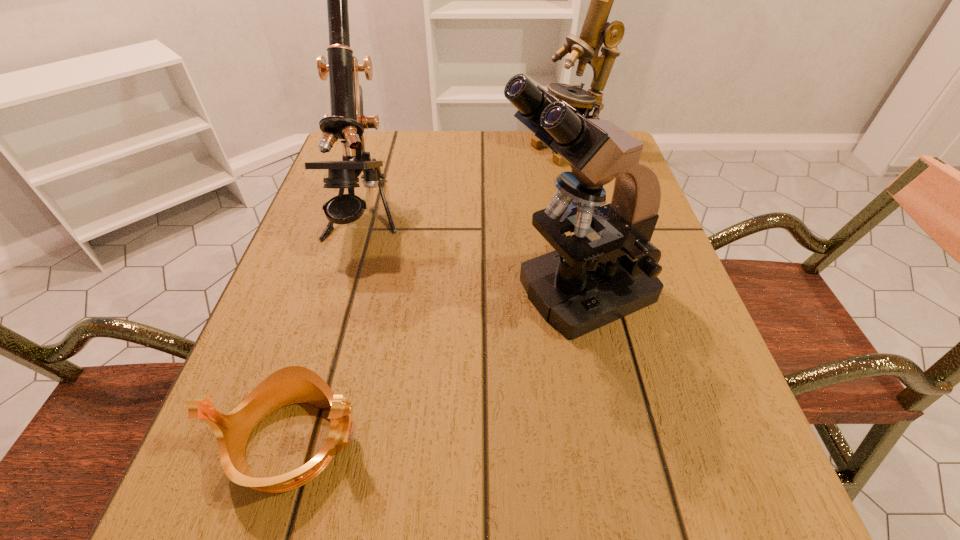
Locate an element on the screen. the farthest object is located at coordinates (596, 31).

Identify the location of the leftmost microscope. (347, 122).

Where is `the nearest object`? Image resolution: width=960 pixels, height=540 pixels. the nearest object is located at coordinates (294, 384).

The height and width of the screenshot is (540, 960). Find the location of `tiara`. tiara is located at coordinates (294, 384).

Locate an element on the screen. This screenshot has width=960, height=540. vacant region located on the front of the farthest object is located at coordinates (587, 217).

At what (x,y) coordinates should I click in order to perform the action: click on free space located 0.370m through the eyepiece of the leftmost microscope. Please return your answer as a coordinate pair (x, y). Image resolution: width=960 pixels, height=540 pixels. Looking at the image, I should click on (296, 453).

You are a GUI agent. You are given a task and a screenshot of the screen. Output one action in this format:
    pyautogui.click(x=<x>, y=<y>)
    Task: Click on the free space located 0.180m at the front emblem of the shortest object
    The height and width of the screenshot is (540, 960).
    Given the screenshot: What is the action you would take?
    pyautogui.click(x=496, y=442)

Find the location of a particular element. The width and height of the screenshot is (960, 540). object positioned at the near edge is located at coordinates (294, 384).

The width and height of the screenshot is (960, 540). I want to click on microscope that is positioned at the left edge, so click(347, 122).

What are the coordinates of `tiara located at the left edge` in the screenshot? It's located at (294, 384).